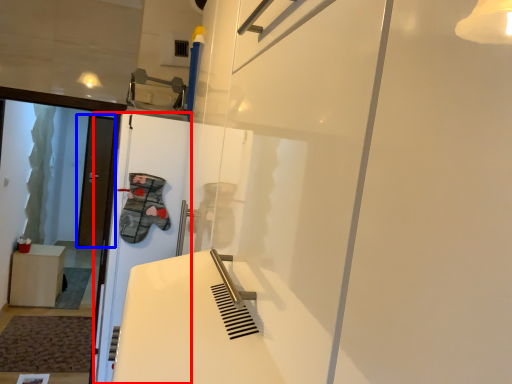
Question: Which point is closer to the camera, screen door (highlighted by a red box) or door (highlighted by a blue box)?

Choices:
 (A) screen door
 (B) door

Answer: (A)